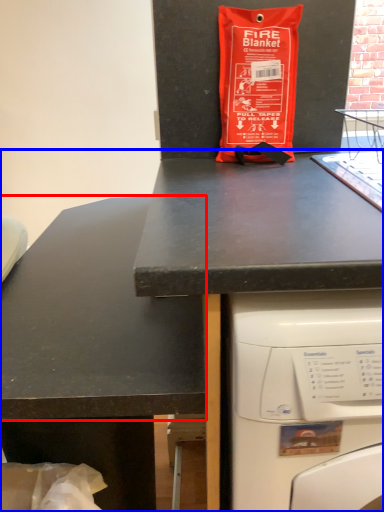
Question: Which of the following is the closest to the observer, counter top (highlighted by a red box) or desk (highlighted by a blue box)?

Choices:
 (A) counter top
 (B) desk

Answer: (B)